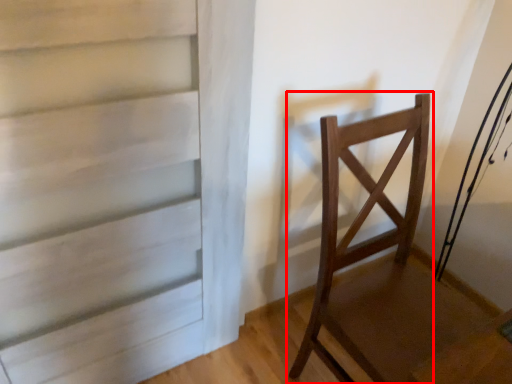
Question: From the image's perspective, what is the correct spatial relationship of chair (annotated by the red box) in relation to door?

Choices:
 (A) below
 (B) above

Answer: (A)